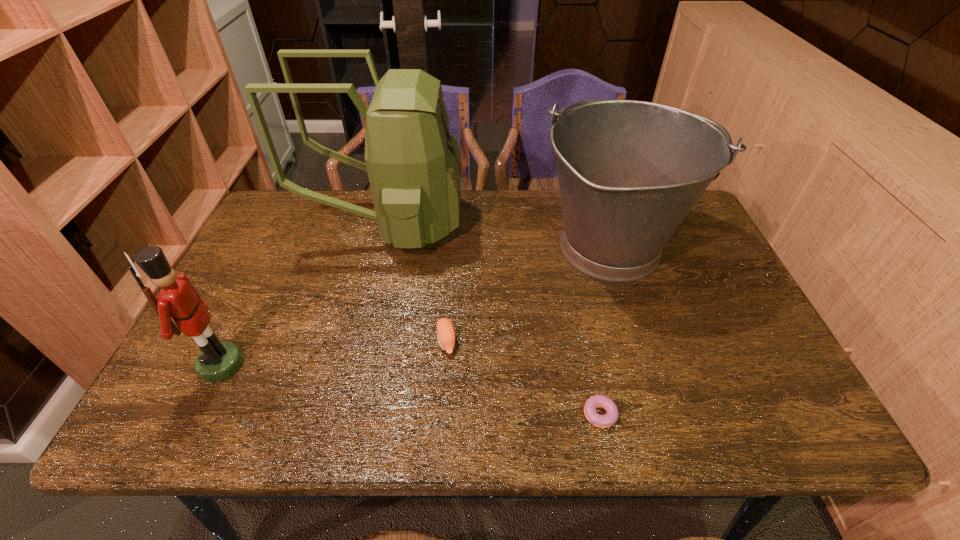
Locate an element on the screen. unoccupied area between the doughnut and the bucket is located at coordinates (604, 331).

Identify the location of empty location between the sushi and the bucket. This screenshot has width=960, height=540. (528, 294).

Where is `the fourth closest object to the doughnut`? the fourth closest object to the doughnut is located at coordinates (218, 360).

Point out which object is positioned as the third nearest to the tallest object. Please provide its 2D coordinates. Your answer should be formatted as a tuple, i.e. [(x, y)], where the tuple contains the x and y coordinates of a point satisfying the conditions above.

[(218, 360)]

At what (x,y) coordinates should I click in order to perform the action: click on vacant space that satisfies the following two spatial constraints: 1. on the front-facing side of the leftmost object; 2. on the back side of the nearest object. Please return your answer as a coordinate pair (x, y). Looking at the image, I should click on (197, 414).

Locate an element on the screen. vacant area in the image that satisfies the following two spatial constraints: 1. on the back side of the doughnut; 2. on the right side of the bucket is located at coordinates (564, 247).

The height and width of the screenshot is (540, 960). Identify the location of free location that satisfies the following two spatial constraints: 1. on the back side of the second shortest object; 2. on the right side of the bucket. (452, 247).

Where is `vacant space that satisfies the following two spatial constraints: 1. on the front pocket of the tallest object; 2. on the right side of the bucket`? This screenshot has height=540, width=960. vacant space that satisfies the following two spatial constraints: 1. on the front pocket of the tallest object; 2. on the right side of the bucket is located at coordinates (383, 247).